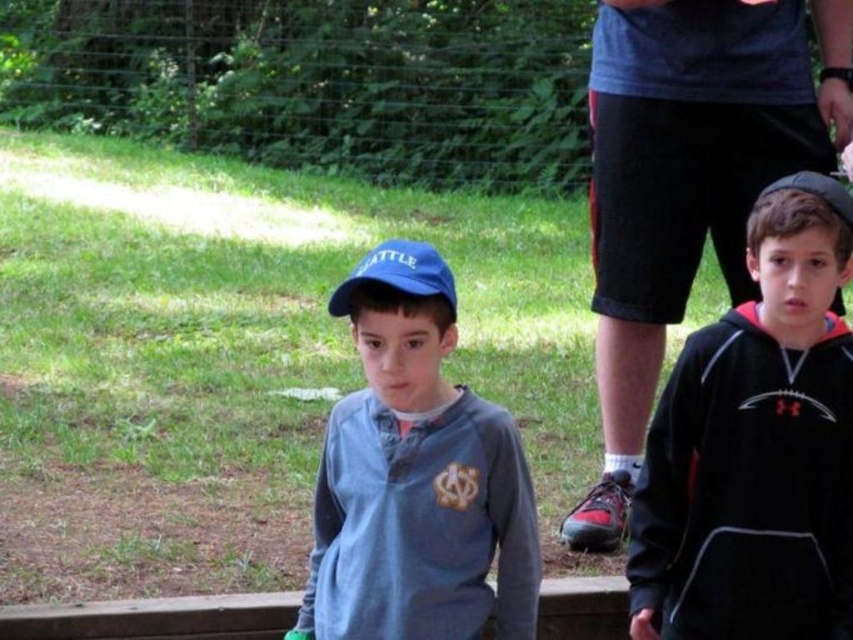
Question: Is matte blue cap at center wider than blue fabric baseball cap at center?

Choices:
 (A) yes
 (B) no

Answer: (A)

Question: Estimate the real-world distances between objects in this image. Which object is closer to the matte blue cap at center?

Choices:
 (A) black fleece sweatshirt at right
 (B) blue fabric baseball cap at center
 (C) dark gray fabric shorts at right

Answer: (B)

Question: Is black fleece sweatshirt at right positioned before matte blue cap at center?

Choices:
 (A) no
 (B) yes

Answer: (A)

Question: Which object is the closest to the black fleece sweatshirt at right?

Choices:
 (A) matte blue cap at center
 (B) blue fabric baseball cap at center

Answer: (A)

Question: Which of the following is the farthest from the observer?

Choices:
 (A) black fleece sweatshirt at right
 (B) dark gray fabric shorts at right
 (C) matte blue cap at center
 (D) blue fabric baseball cap at center

Answer: (B)

Question: Can you confirm if matte blue cap at center is bigger than blue fabric baseball cap at center?

Choices:
 (A) no
 (B) yes

Answer: (B)